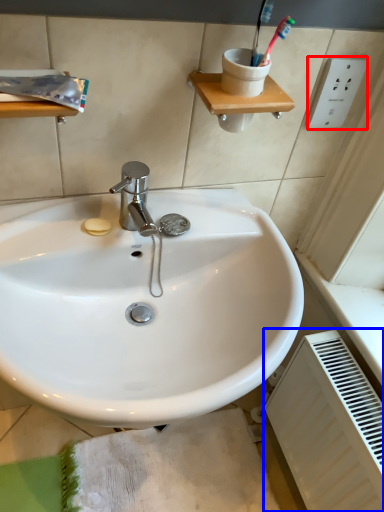
Question: Which of the following is the closest to the observer, electric outlet (highlighted by a red box) or radiator (highlighted by a blue box)?

Choices:
 (A) electric outlet
 (B) radiator

Answer: (B)